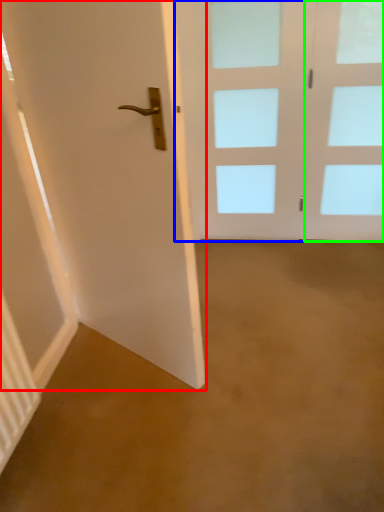
Question: Considering the real-world distances, which object is closest to door (highlighted by a red box)? door (highlighted by a blue box) or glass door (highlighted by a green box).

Choices:
 (A) door
 (B) glass door

Answer: (A)